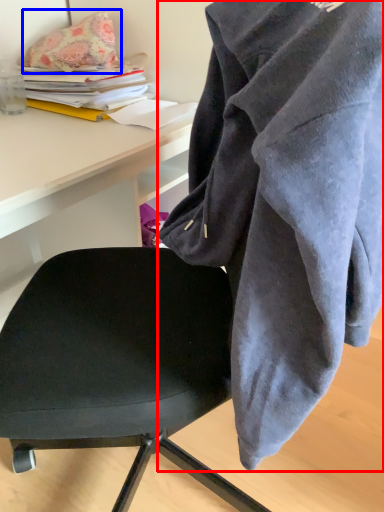
Question: Which object appears closest to the camera in this image, cloak (highlighted by a red box) or pillow (highlighted by a blue box)?

Choices:
 (A) cloak
 (B) pillow

Answer: (A)